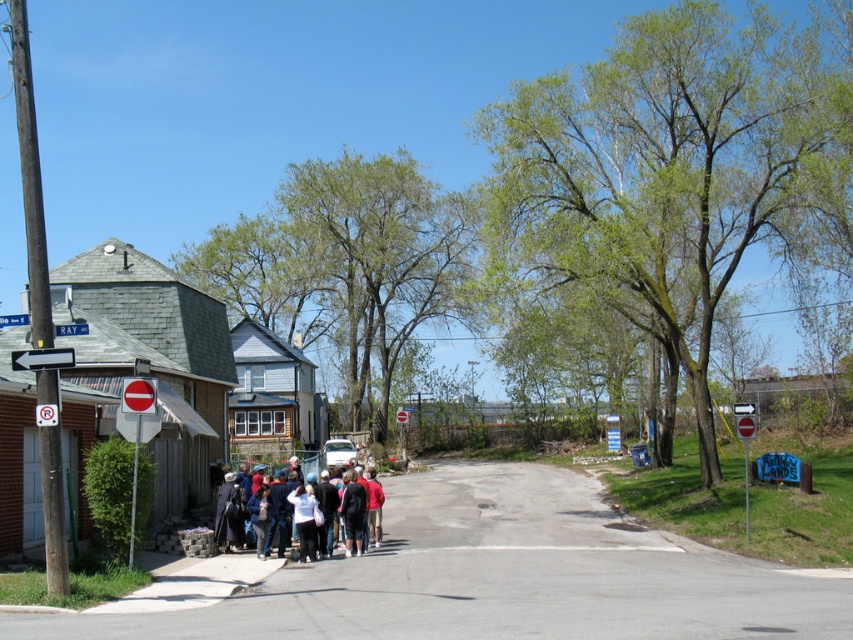
Question: Which point is farther from the camera taking this photo?

Choices:
 (A) (64, 365)
 (B) (125, 408)
 (C) (334, 513)

Answer: (C)

Question: Does white plastic arrow at left appear on the right side of red plastic stop sign at center?

Choices:
 (A) yes
 (B) no

Answer: (B)

Question: Is dark blue jacket at center bigger than white plastic arrow at left?

Choices:
 (A) no
 (B) yes

Answer: (B)

Question: Which point is closer to the camera?

Choices:
 (A) (131, 381)
 (B) (355, 538)

Answer: (A)

Question: Can you confirm if dark blue jacket at center is smaller than white plastic arrow at left?

Choices:
 (A) yes
 (B) no

Answer: (B)

Question: Which point is closer to the camera?

Choices:
 (A) white plastic arrow at left
 (B) dark blue jacket at center

Answer: (A)